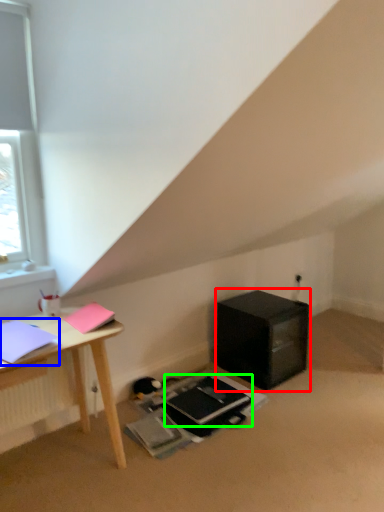
Question: Estimate the real-world distances between objects in this image. Which object is closer to nightstand (highlighted by a red box), notebook (highlighted by a blue box) or notebook (highlighted by a green box)?

Choices:
 (A) notebook
 (B) notebook

Answer: (B)